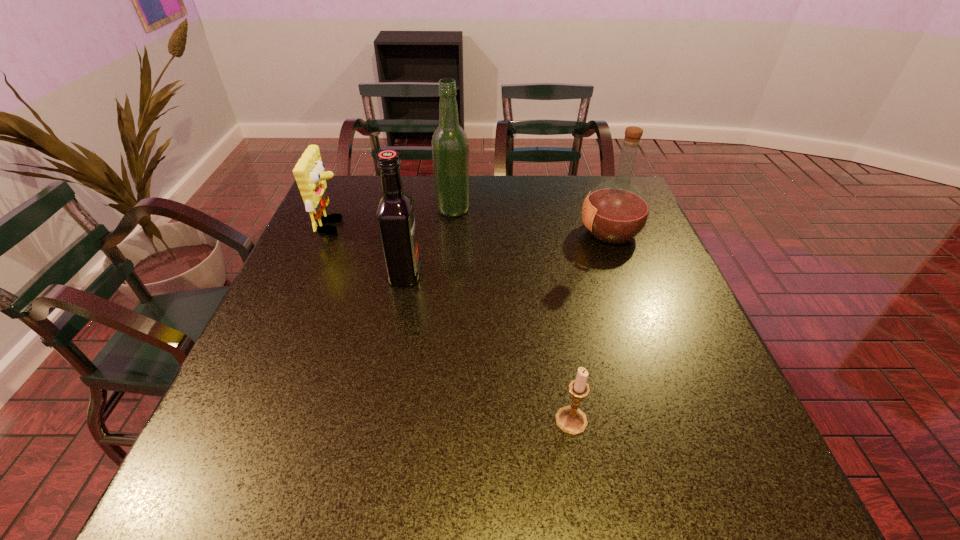
The image size is (960, 540). Find the location of `the third object from right to left`. the third object from right to left is located at coordinates click(x=450, y=148).

Where is `the nearest liquor`? This screenshot has width=960, height=540. the nearest liquor is located at coordinates point(395,214).

The width and height of the screenshot is (960, 540). What are the coordinates of `the leftmost liquor` in the screenshot? It's located at (395, 214).

This screenshot has width=960, height=540. In order to click on the rightmost liquor in this screenshot , I will do [x=615, y=212].

Locate an element on the screen. The width and height of the screenshot is (960, 540). sponge is located at coordinates (309, 173).

The height and width of the screenshot is (540, 960). I want to click on the leftmost object, so click(309, 173).

Find the location of a particular element. The image size is (960, 540). candle holder is located at coordinates (570, 420).

The image size is (960, 540). Identify the location of the fourth object from left to right. (570, 420).

The width and height of the screenshot is (960, 540). I want to click on vacant space located 0.240m on the front of the second liquor from left to right, so click(x=448, y=273).

Find the location of a particular element. This screenshot has width=960, height=540. free spot located on the front-facing side of the nearest liquor is located at coordinates (537, 274).